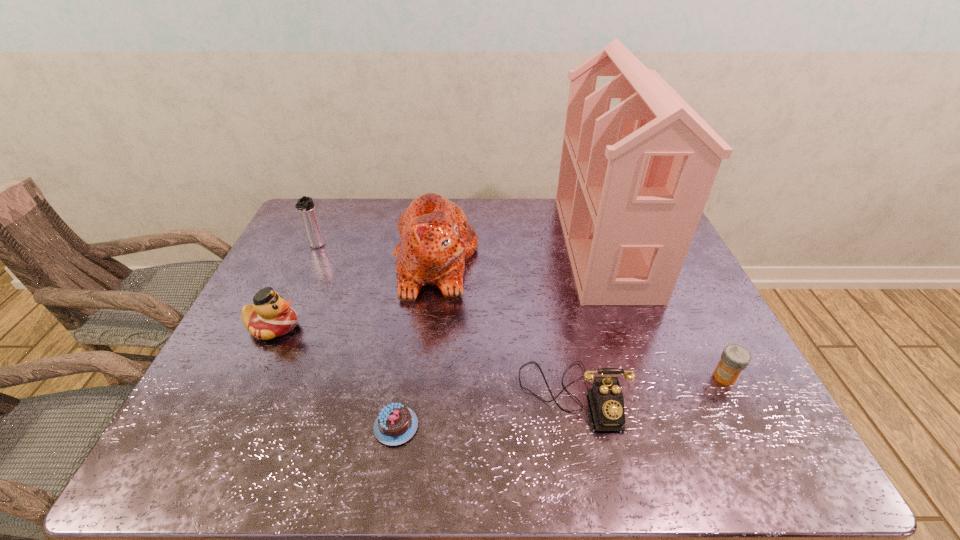
Find the location of a particular element. The width and height of the screenshot is (960, 540). vacant space in between the sixth shortest object and the fifth tallest object is located at coordinates (504, 328).

Image resolution: width=960 pixels, height=540 pixels. I want to click on vacant area that lies between the sixth shortest object and the fourth farthest object, so click(x=355, y=294).

At what (x,y) coordinates should I click in order to perform the action: click on free space between the cat and the third shortest object. Please return your answer as a coordinate pair (x, y). Looking at the image, I should click on (504, 328).

Image resolution: width=960 pixels, height=540 pixels. Identify the location of the fourth closest object to the chocolate cake. (633, 182).

The height and width of the screenshot is (540, 960). Identify the location of object that is the third nearest to the thermos bottle. (396, 424).

Identify the location of vacant point that satisfies the following two spatial constraints: 1. on the label side of the medicine; 2. on the dial of the fifth tallest object. This screenshot has height=540, width=960. (734, 395).